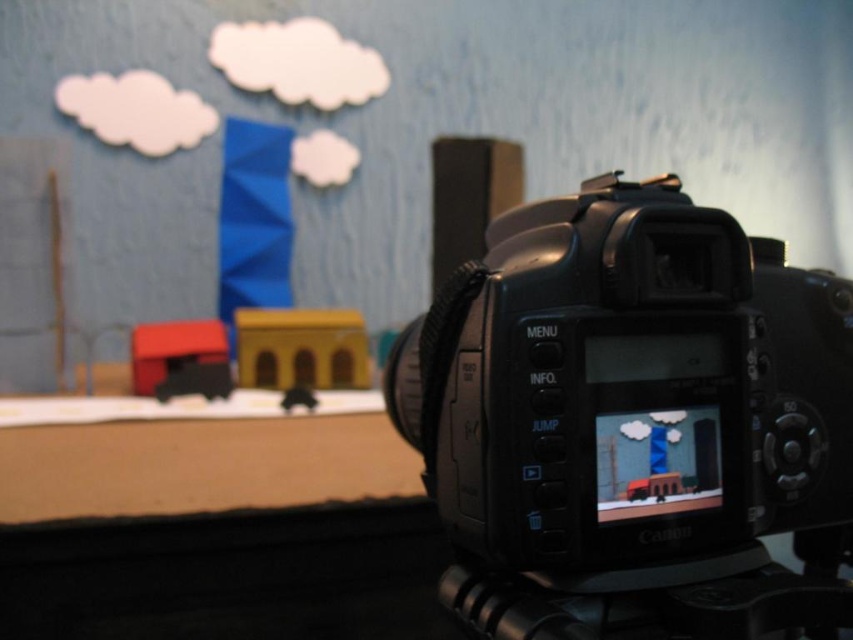
Which of these two, black plastic camera at center or black rubber tripod at lower center, stands shorter?

With less height is black rubber tripod at lower center.

Who is more forward, (802, 323) or (741, 580)?

Point (741, 580)

Describe the element at coordinates (627, 385) in the screenshot. The width and height of the screenshot is (853, 640). I see `black plastic camera at center` at that location.

Locate an element on the screen. This screenshot has width=853, height=640. black plastic camera at center is located at coordinates (627, 385).

Looking at this image, is matte paper clouds at upper center shorter than black plastic camera at center?

No, matte paper clouds at upper center is not shorter than black plastic camera at center.

This screenshot has width=853, height=640. I want to click on matte paper clouds at upper center, so click(422, 134).

Which of these two, matte paper clouds at upper center or black rubber tripod at lower center, stands taller?

With more height is matte paper clouds at upper center.

Who is positioned more to the left, matte paper clouds at upper center or black rubber tripod at lower center?

matte paper clouds at upper center is more to the left.

Who is more distant from viewer, (160, 316) or (830, 593)?

Positioned behind is point (160, 316).

The height and width of the screenshot is (640, 853). I want to click on matte paper clouds at upper center, so click(422, 134).